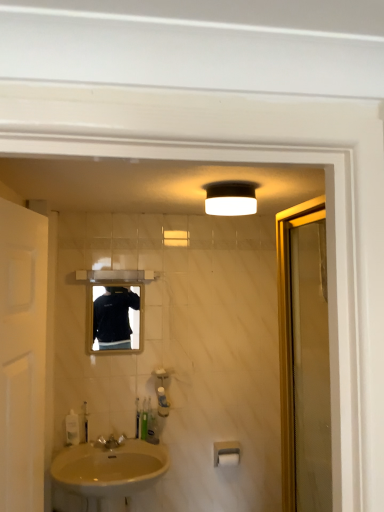
This screenshot has height=512, width=384. Find the location of `free area in between silver metallic faucet at lower center and translucent plastic soap dispenser at lower left`. free area in between silver metallic faucet at lower center and translucent plastic soap dispenser at lower left is located at coordinates (93, 445).